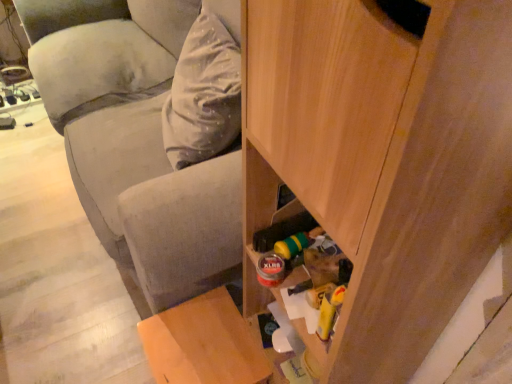
Question: Would you say wooden stool at lower left is a long distance from wooden cabinet at lower right?

Choices:
 (A) yes
 (B) no

Answer: (B)

Question: Does wooden stool at lower left appear on the right side of wooden cabinet at lower right?

Choices:
 (A) no
 (B) yes

Answer: (A)

Question: Is wooden stool at lower left outside wooden cabinet at lower right?

Choices:
 (A) no
 (B) yes

Answer: (B)

Question: From a real-world perspective, is wooden stool at lower left under wooden cabinet at lower right?

Choices:
 (A) no
 (B) yes

Answer: (B)

Question: Is wooden stool at lower left bigger than wooden cabinet at lower right?

Choices:
 (A) yes
 (B) no

Answer: (B)

Question: In terms of height, does wooden cabinet at lower right look taller or shorter compared to wooden stool at lower left?

Choices:
 (A) tall
 (B) short

Answer: (A)

Question: Is wooden cabinet at lower right in front of or behind wooden stool at lower left in the image?

Choices:
 (A) behind
 (B) front

Answer: (B)

Question: Considering the relative positions of wooden cabinet at lower right and wooden stool at lower left in the image provided, is wooden cabinet at lower right to the left or to the right of wooden stool at lower left?

Choices:
 (A) left
 (B) right

Answer: (B)

Question: Does point (326, 213) appear closer or farther from the camera than point (173, 370)?

Choices:
 (A) farther
 (B) closer

Answer: (B)

Question: In terms of width, does wooden cabinet at lower right look wider or thinner when compared to velvety gray pillow at upper left?

Choices:
 (A) thin
 (B) wide

Answer: (B)

Question: From the image's perspective, relative to velvety gray pillow at upper left, is wooden cabinet at lower right above or below?

Choices:
 (A) below
 (B) above

Answer: (A)

Question: Relative to velvety gray pillow at upper left, is wooden cabinet at lower right in front or behind?

Choices:
 (A) behind
 (B) front

Answer: (B)

Question: Visually, is wooden cabinet at lower right positioned to the left or to the right of velvety gray pillow at upper left?

Choices:
 (A) right
 (B) left

Answer: (A)

Question: From the image's perspective, is wooden stool at lower left positioned above or below wooden cabinet at lower right?

Choices:
 (A) above
 (B) below

Answer: (B)

Question: Considering the positions of wooden stool at lower left and wooden cabinet at lower right in the image, is wooden stool at lower left bigger or smaller than wooden cabinet at lower right?

Choices:
 (A) big
 (B) small

Answer: (B)